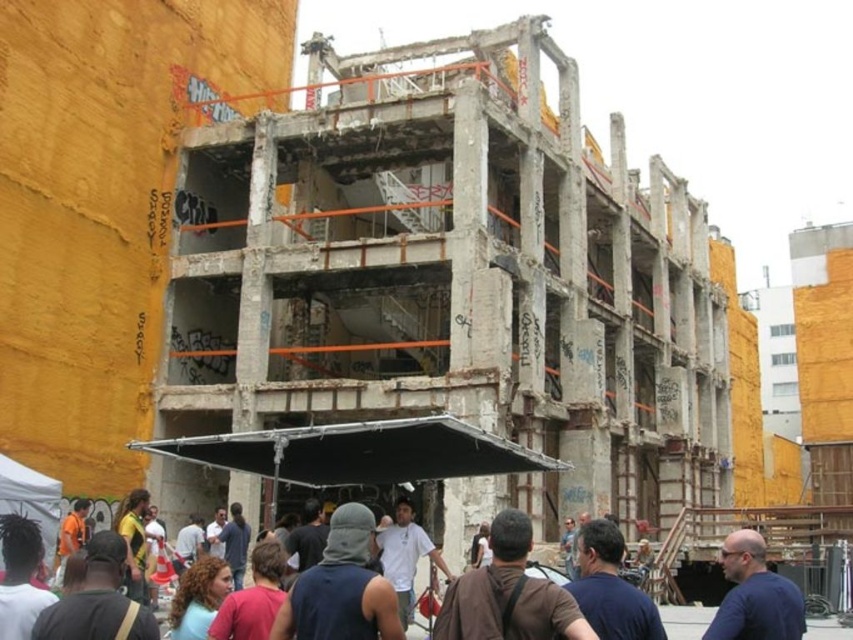
You are a photographer positioned at the back of the crowd. You want to take a photo of the blue shirt at center without including the dark brown leather jacket at lower center in the frame. Which direction should you move to avoid capturing the jacket?

You should move to the right to avoid capturing the dark brown leather jacket at lower center, since it is to the left of the blue shirt at center.

You are a delivery drone with GPS coordinates. You need to drop a package at the dark brown leather jacket at lower center located at point 0.930, 0.885. What coordinates should you aim for?

The dark brown leather jacket at lower center is located at coordinates [753,595], so you should aim for those coordinates to drop the package.